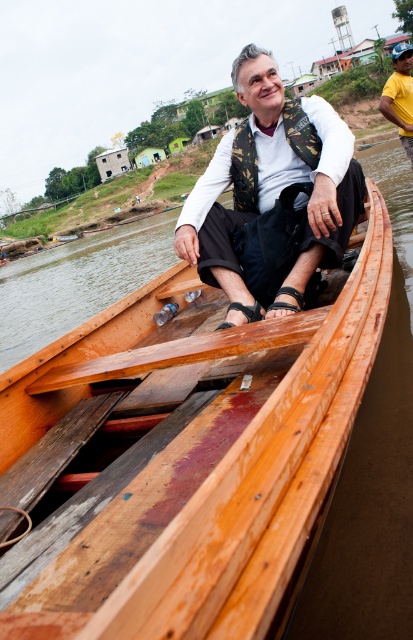
You are a photographer trying to capture the camouflage fabric vest at center in the image. The vest is located at point (272, 196). To ensure the vest is in focus, you need to know its position relative to the boat. Is the vest positioned closer to the front or the back of the boat?

The camouflage fabric vest at center is located at point (272, 196), which is closer to the front of the boat.

You are standing on the riverbank and see the wooden boat at center and the yellow cotton shirt at right. Which object is closer to the water surface?

The wooden boat at center is closer to the water surface because it is located below the yellow cotton shirt at right.

You are standing on the riverbank and see two points marked on the wooden boat. The first point is at coordinates point (234,392) and the second point is at point (401,97). Which point is closer to you?

Point (234,392) is in front of point (401,97), so it is closer to you.